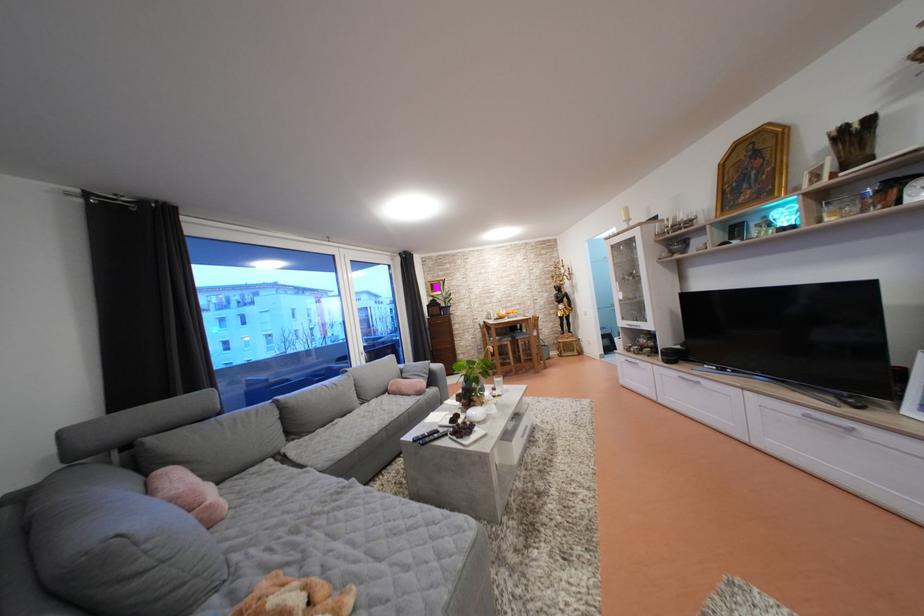
Find where to sit the grey sofa sitting surface. Please return your answer as a coordinate pair (x, y).

(323, 540)